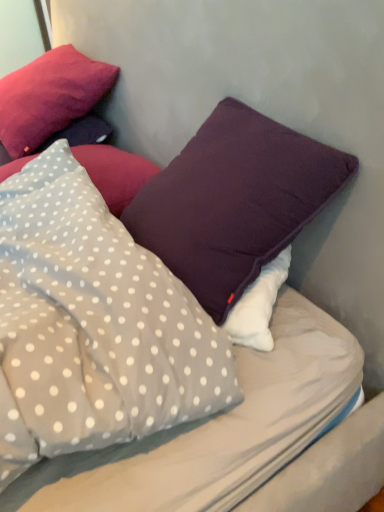
In order to face gray polka dot pillow at center, the fourth pillow when ordered from top to bottom, should I rotate leftwards or rightwards?

Rotate your view left by about 17.726°.

Describe the element at coordinates (234, 201) in the screenshot. I see `purple matte pillow at upper right, which appears as the second pillow when ordered from the bottom` at that location.

This screenshot has height=512, width=384. In order to click on gray polka dot pillow at center, the fourth pillow when ordered from top to bottom in this screenshot , I will do `click(92, 325)`.

Is matte purple pillow at upper left, positioned as the 4th pillow in bottom-to-top order, facing towards purple matte pillow at upper right, arranged as the 3th pillow when viewed from the top?

No, matte purple pillow at upper left, positioned as the 4th pillow in bottom-to-top order, is not turned towards purple matte pillow at upper right, arranged as the 3th pillow when viewed from the top.

Is matte purple pillow at upper left, positioned as the 4th pillow in bottom-to-top order, taller than purple matte pillow at upper right, arranged as the 3th pillow when viewed from the top?

No.

There is a purple matte pillow at upper right, which appears as the second pillow when ordered from the bottom. Identify the location of the 2nd pillow above it (from the image's perspective). The width and height of the screenshot is (384, 512). (49, 97).

The width and height of the screenshot is (384, 512). Find the location of `pillow that appears behind the white dotted fabric pillow at upper left, the second pillow when ordered from top to bottom`. pillow that appears behind the white dotted fabric pillow at upper left, the second pillow when ordered from top to bottom is located at coordinates (49, 97).

How distant is white dotted fabric pillow at upper left, the third pillow in the bottom-to-top sequence, from matte purple pillow at upper left, arranged as the first pillow when viewed from the top?

9.25 inches.

From a real-world perspective, is white dotted fabric pillow at upper left, the third pillow in the bottom-to-top sequence, physically located above or below matte purple pillow at upper left, positioned as the 4th pillow in bottom-to-top order?

In terms of real-world spatial position, white dotted fabric pillow at upper left, the third pillow in the bottom-to-top sequence, is below matte purple pillow at upper left, positioned as the 4th pillow in bottom-to-top order.

Could you tell me if white dotted fabric pillow at upper left, the third pillow in the bottom-to-top sequence, is facing matte purple pillow at upper left, arranged as the first pillow when viewed from the top?

No.

Can you confirm if white dotted fabric pillow at upper left, the second pillow when ordered from top to bottom, is wider than gray polka dot pillow at center, which is counted as the first pillow, starting from the bottom?

Correct, the width of white dotted fabric pillow at upper left, the second pillow when ordered from top to bottom, exceeds that of gray polka dot pillow at center, which is counted as the first pillow, starting from the bottom.

Is gray polka dot pillow at center, which is counted as the first pillow, starting from the bottom, inside white dotted fabric pillow at upper left, the second pillow when ordered from top to bottom?

No, white dotted fabric pillow at upper left, the second pillow when ordered from top to bottom, does not contain gray polka dot pillow at center, which is counted as the first pillow, starting from the bottom.

Would you say white dotted fabric pillow at upper left, the second pillow when ordered from top to bottom, is a long distance from gray polka dot pillow at center, which is counted as the first pillow, starting from the bottom?

No, there isn't a large distance between white dotted fabric pillow at upper left, the second pillow when ordered from top to bottom, and gray polka dot pillow at center, which is counted as the first pillow, starting from the bottom.

Which object is closer to the camera taking this photo, white dotted fabric pillow at upper left, the third pillow in the bottom-to-top sequence, or gray polka dot pillow at center, which is counted as the first pillow, starting from the bottom?

gray polka dot pillow at center, which is counted as the first pillow, starting from the bottom, is closer to the camera.

Is matte purple pillow at upper left, arranged as the first pillow when viewed from the top, bigger or smaller than white dotted fabric pillow at upper left, the second pillow when ordered from top to bottom?

matte purple pillow at upper left, arranged as the first pillow when viewed from the top, is bigger than white dotted fabric pillow at upper left, the second pillow when ordered from top to bottom.

From the image's perspective, which is below, matte purple pillow at upper left, arranged as the first pillow when viewed from the top, or white dotted fabric pillow at upper left, the second pillow when ordered from top to bottom?

white dotted fabric pillow at upper left, the second pillow when ordered from top to bottom, from the image's perspective.

Is matte purple pillow at upper left, arranged as the first pillow when viewed from the top, far away from white dotted fabric pillow at upper left, the third pillow in the bottom-to-top sequence?

No, matte purple pillow at upper left, arranged as the first pillow when viewed from the top, is in close proximity to white dotted fabric pillow at upper left, the third pillow in the bottom-to-top sequence.

You are a GUI agent. You are given a task and a screenshot of the screen. Output one action in this format:
    pyautogui.click(x=<x>, y=<y>)
    Task: Click on the pillow on the left of white dotted fabric pillow at upper left, the third pillow in the bottom-to-top sequence
    This screenshot has width=384, height=512.
    Given the screenshot: What is the action you would take?
    pyautogui.click(x=49, y=97)

Could you tell me if matte purple pillow at upper left, arranged as the first pillow when viewed from the top, is turned towards gray polka dot pillow at center, the fourth pillow when ordered from top to bottom?

No, matte purple pillow at upper left, arranged as the first pillow when viewed from the top, is not facing towards gray polka dot pillow at center, the fourth pillow when ordered from top to bottom.

Consider the image. Is matte purple pillow at upper left, positioned as the 4th pillow in bottom-to-top order, shorter than gray polka dot pillow at center, the fourth pillow when ordered from top to bottom?

Incorrect, the height of matte purple pillow at upper left, positioned as the 4th pillow in bottom-to-top order, does not fall short of that of gray polka dot pillow at center, the fourth pillow when ordered from top to bottom.

Which is correct: matte purple pillow at upper left, arranged as the first pillow when viewed from the top, is inside gray polka dot pillow at center, which is counted as the first pillow, starting from the bottom, or outside of it?

matte purple pillow at upper left, arranged as the first pillow when viewed from the top, is located beyond the bounds of gray polka dot pillow at center, which is counted as the first pillow, starting from the bottom.

Does white dotted fabric pillow at upper left, the second pillow when ordered from top to bottom, have a smaller size compared to purple matte pillow at upper right, arranged as the 3th pillow when viewed from the top?

Correct, white dotted fabric pillow at upper left, the second pillow when ordered from top to bottom, occupies less space than purple matte pillow at upper right, arranged as the 3th pillow when viewed from the top.

Is white dotted fabric pillow at upper left, the second pillow when ordered from top to bottom, not within purple matte pillow at upper right, arranged as the 3th pillow when viewed from the top?

Yes, white dotted fabric pillow at upper left, the second pillow when ordered from top to bottom, is outside of purple matte pillow at upper right, arranged as the 3th pillow when viewed from the top.

Would you say white dotted fabric pillow at upper left, the third pillow in the bottom-to-top sequence, is a long distance from purple matte pillow at upper right, arranged as the 3th pillow when viewed from the top?

No, white dotted fabric pillow at upper left, the third pillow in the bottom-to-top sequence, is not far from purple matte pillow at upper right, arranged as the 3th pillow when viewed from the top.

Measure the distance between gray polka dot pillow at center, which is counted as the first pillow, starting from the bottom, and matte purple pillow at upper left, positioned as the 4th pillow in bottom-to-top order.

gray polka dot pillow at center, which is counted as the first pillow, starting from the bottom, is 24.57 inches from matte purple pillow at upper left, positioned as the 4th pillow in bottom-to-top order.

From a real-world perspective, relative to matte purple pillow at upper left, arranged as the first pillow when viewed from the top, is gray polka dot pillow at center, the fourth pillow when ordered from top to bottom, vertically above or below?

Clearly, from a real-world perspective, gray polka dot pillow at center, the fourth pillow when ordered from top to bottom, is below matte purple pillow at upper left, arranged as the first pillow when viewed from the top.

Is the surface of gray polka dot pillow at center, which is counted as the first pillow, starting from the bottom, in direct contact with matte purple pillow at upper left, positioned as the 4th pillow in bottom-to-top order?

There is a gap between gray polka dot pillow at center, which is counted as the first pillow, starting from the bottom, and matte purple pillow at upper left, positioned as the 4th pillow in bottom-to-top order.

Can you confirm if gray polka dot pillow at center, which is counted as the first pillow, starting from the bottom, is shorter than matte purple pillow at upper left, positioned as the 4th pillow in bottom-to-top order?

Yes.

Which pillow is the 2nd one when counting from the back of the purple matte pillow at upper right, which appears as the second pillow when ordered from the bottom? Please provide its 2D coordinates.

[(49, 97)]

The width and height of the screenshot is (384, 512). What are the coordinates of `pillow that is the 1st object to the right of the matte purple pillow at upper left, positioned as the 4th pillow in bottom-to-top order, starting at the anchor` in the screenshot? It's located at (115, 173).

When comparing their distances from white dotted fabric pillow at upper left, the third pillow in the bottom-to-top sequence, does gray polka dot pillow at center, which is counted as the first pillow, starting from the bottom, or purple matte pillow at upper right, which appears as the second pillow when ordered from the bottom, seem closer?

purple matte pillow at upper right, which appears as the second pillow when ordered from the bottom, is closer to white dotted fabric pillow at upper left, the third pillow in the bottom-to-top sequence.

When comparing their distances from matte purple pillow at upper left, arranged as the first pillow when viewed from the top, does purple matte pillow at upper right, which appears as the second pillow when ordered from the bottom, or white dotted fabric pillow at upper left, the second pillow when ordered from top to bottom, seem further?

The object further to matte purple pillow at upper left, arranged as the first pillow when viewed from the top, is purple matte pillow at upper right, which appears as the second pillow when ordered from the bottom.

Estimate the real-world distances between objects in this image. Which object is closer to purple matte pillow at upper right, arranged as the 3th pillow when viewed from the top, matte purple pillow at upper left, positioned as the 4th pillow in bottom-to-top order, or gray polka dot pillow at center, which is counted as the first pillow, starting from the bottom?

gray polka dot pillow at center, which is counted as the first pillow, starting from the bottom, is positioned closer to the anchor purple matte pillow at upper right, arranged as the 3th pillow when viewed from the top.

Looking at the image, which one is located further to purple matte pillow at upper right, arranged as the 3th pillow when viewed from the top, white dotted fabric pillow at upper left, the third pillow in the bottom-to-top sequence, or matte purple pillow at upper left, arranged as the first pillow when viewed from the top?

Among the two, matte purple pillow at upper left, arranged as the first pillow when viewed from the top, is located further to purple matte pillow at upper right, arranged as the 3th pillow when viewed from the top.

From the image, which object appears to be farther from gray polka dot pillow at center, the fourth pillow when ordered from top to bottom, white dotted fabric pillow at upper left, the third pillow in the bottom-to-top sequence, or purple matte pillow at upper right, which appears as the second pillow when ordered from the bottom?

white dotted fabric pillow at upper left, the third pillow in the bottom-to-top sequence, lies further to gray polka dot pillow at center, the fourth pillow when ordered from top to bottom, than the other object.

Estimate the real-world distances between objects in this image. Which object is closer to white dotted fabric pillow at upper left, the third pillow in the bottom-to-top sequence, purple matte pillow at upper right, arranged as the 3th pillow when viewed from the top, or gray polka dot pillow at center, the fourth pillow when ordered from top to bottom?

The object closer to white dotted fabric pillow at upper left, the third pillow in the bottom-to-top sequence, is purple matte pillow at upper right, arranged as the 3th pillow when viewed from the top.

Which object lies nearer to the anchor point gray polka dot pillow at center, the fourth pillow when ordered from top to bottom, matte purple pillow at upper left, arranged as the first pillow when viewed from the top, or white dotted fabric pillow at upper left, the second pillow when ordered from top to bottom?

Among the two, white dotted fabric pillow at upper left, the second pillow when ordered from top to bottom, is located nearer to gray polka dot pillow at center, the fourth pillow when ordered from top to bottom.

Based on their spatial positions, is purple matte pillow at upper right, arranged as the 3th pillow when viewed from the top, or gray polka dot pillow at center, the fourth pillow when ordered from top to bottom, closer to matte purple pillow at upper left, arranged as the first pillow when viewed from the top?

gray polka dot pillow at center, the fourth pillow when ordered from top to bottom, is positioned closer to the anchor matte purple pillow at upper left, arranged as the first pillow when viewed from the top.

The height and width of the screenshot is (512, 384). In order to click on pillow positioned between gray polka dot pillow at center, which is counted as the first pillow, starting from the bottom, and white dotted fabric pillow at upper left, the second pillow when ordered from top to bottom, from near to far in this screenshot , I will do `click(234, 201)`.

The width and height of the screenshot is (384, 512). Find the location of `pillow between purple matte pillow at upper right, which appears as the second pillow when ordered from the bottom, and matte purple pillow at upper left, arranged as the first pillow when viewed from the top, along the z-axis`. pillow between purple matte pillow at upper right, which appears as the second pillow when ordered from the bottom, and matte purple pillow at upper left, arranged as the first pillow when viewed from the top, along the z-axis is located at coordinates (115, 173).